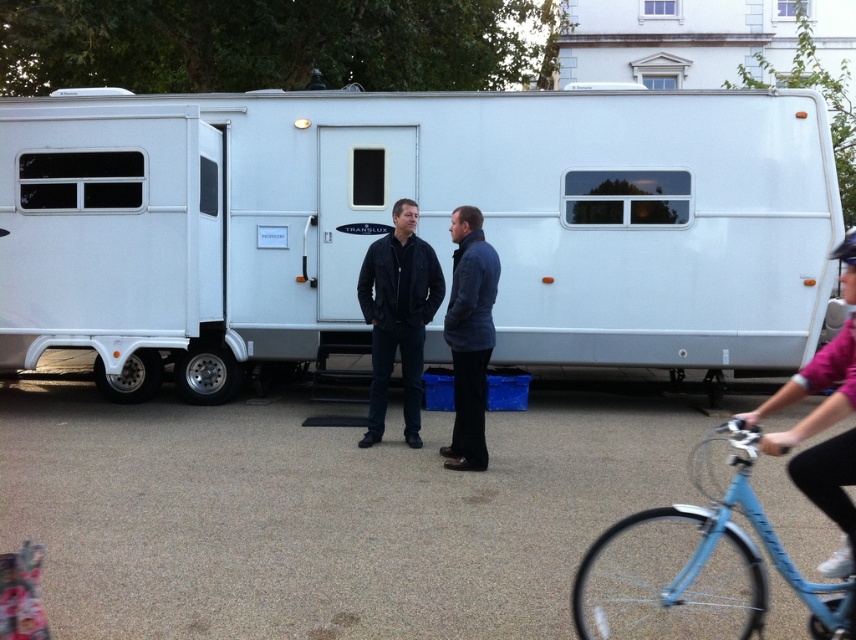
Consider the image. You are standing at the position of the person on the light blue bicycle. You want to walk to the trailer. Which point should you walk through first, point (646, 589) or point (409, 268)?

You should walk through point (646, 589) first because it is in front of point (409, 268), so it is closer to your starting position.

You are a cyclist who just arrived at the scene and noticed the pink fabric helmet at upper right. Where should you place your bicycle to avoid blocking the trailer entrance?

Place the bicycle away from the trailer entrance to avoid blocking it. The pink fabric helmet at upper right is located at point (813, 392), so position the bicycle in a different area such as the left side or behind the trailer.

From the picture: You are a delivery person who needs to choose between the pink fabric helmet at upper right and the black leather jacket at center for protection. Which item has a smaller width?

The pink fabric helmet at upper right has a lesser width compared to the black leather jacket at center, so it is smaller in width.